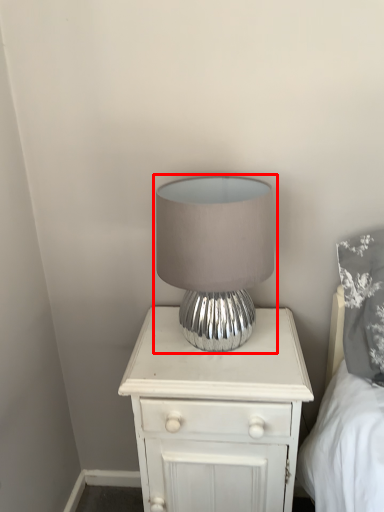
Question: Where is lamp (annotated by the red box) located in relation to nightstand in the image?

Choices:
 (A) left
 (B) right

Answer: (A)